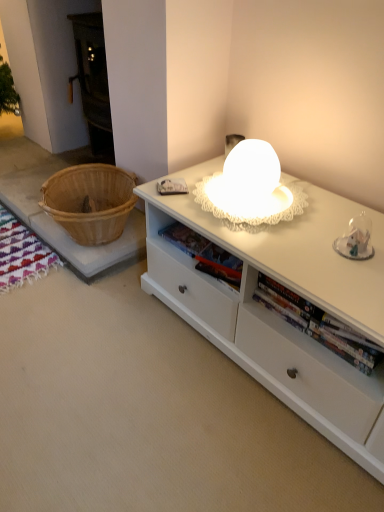
Question: Considering the positions of white matte cabinet at center and hardcover book at center in the image, is white matte cabinet at center wider or thinner than hardcover book at center?

Choices:
 (A) thin
 (B) wide

Answer: (B)

Question: From a real-world perspective, relative to hardcover book at center, is white matte cabinet at center vertically above or below?

Choices:
 (A) above
 (B) below

Answer: (B)

Question: Does point (380, 396) appear closer or farther from the camera than point (175, 224)?

Choices:
 (A) farther
 (B) closer

Answer: (B)

Question: Is hardcover book at center in front of or behind white matte cabinet at center in the image?

Choices:
 (A) front
 (B) behind

Answer: (B)

Question: Based on their sizes in the image, would you say hardcover book at center is bigger or smaller than white matte cabinet at center?

Choices:
 (A) small
 (B) big

Answer: (A)

Question: From the image's perspective, relative to white matte cabinet at center, is hardcover book at center above or below?

Choices:
 (A) below
 (B) above

Answer: (A)

Question: Considering the positions of hardcover book at center and white matte cabinet at center in the image, is hardcover book at center taller or shorter than white matte cabinet at center?

Choices:
 (A) tall
 (B) short

Answer: (B)